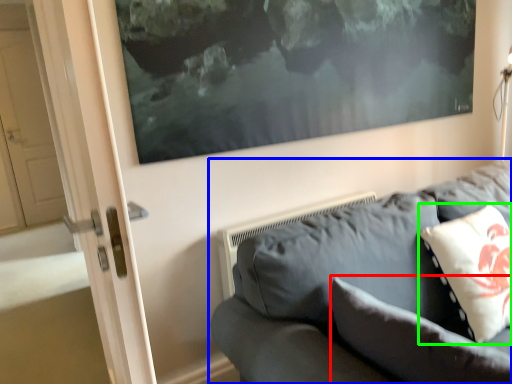
Question: Which is nearer to the pillow (highlighted by a red box)? studio couch (highlighted by a blue box) or pillow (highlighted by a green box).

Choices:
 (A) studio couch
 (B) pillow

Answer: (A)